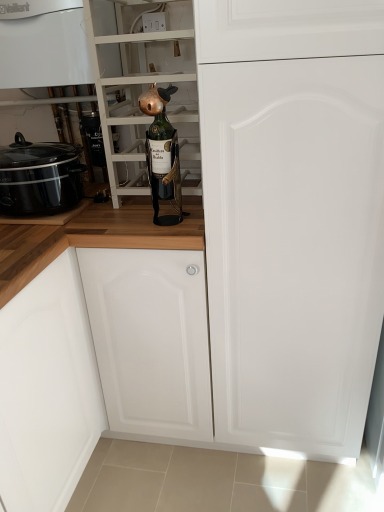
Where is `vacant area that is in front of green glass bottle at center`? The image size is (384, 512). vacant area that is in front of green glass bottle at center is located at coordinates (168, 233).